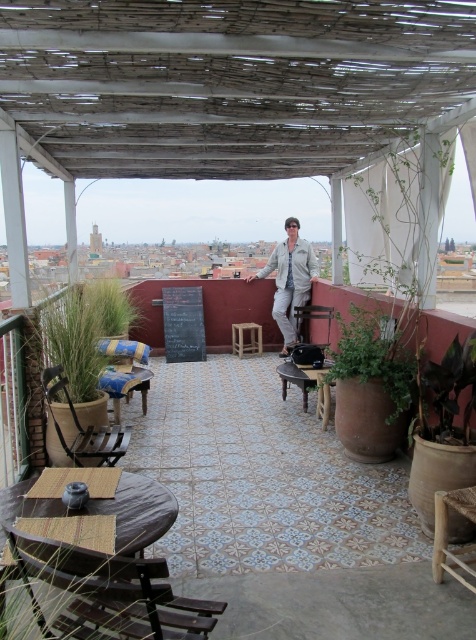
Who is lower down, wooden chair at left or green glossy leafy plant at center-right?

wooden chair at left

What do you see at coordinates (82, 426) in the screenshot?
I see `wooden chair at left` at bounding box center [82, 426].

Where is `wooden chair at left`? The image size is (476, 640). wooden chair at left is located at coordinates (82, 426).

Who is positioned more to the right, green glossy leafy plant at center-right or woven wood chair at lower right?

From the viewer's perspective, green glossy leafy plant at center-right appears more on the right side.

Is green glossy leafy plant at center-right thinner than woven wood chair at lower right?

No.

Does point (455, 368) lie in front of point (466, 506)?

That is False.

Find the location of a particular element. The width and height of the screenshot is (476, 640). green glossy leafy plant at center-right is located at coordinates (446, 392).

Can you confirm if wooden woven chair at lower left is smaller than light gray fabric jacket at center?

Correct, wooden woven chair at lower left occupies less space than light gray fabric jacket at center.

Identify the location of wooden woven chair at lower left. This screenshot has width=476, height=640. (109, 593).

The height and width of the screenshot is (640, 476). What do you see at coordinates (109, 593) in the screenshot?
I see `wooden woven chair at lower left` at bounding box center [109, 593].

Locate an element on the screen. wooden woven chair at lower left is located at coordinates [x=109, y=593].